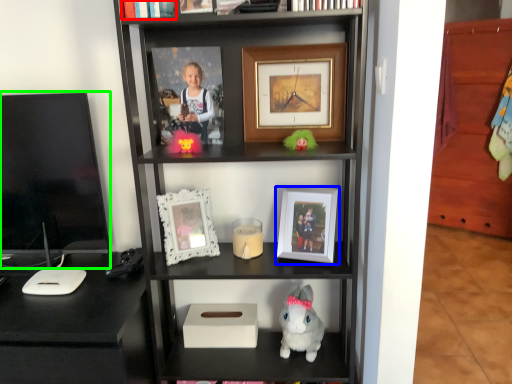
Question: Which object is the farthest from book (highlighted by a red box)? Choose among these: picture frame (highlighted by a blue box) or television (highlighted by a green box).

Choices:
 (A) picture frame
 (B) television

Answer: (A)